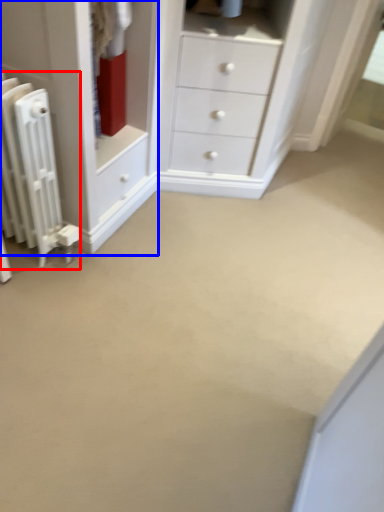
Question: Which of the following is the farthest to the observer, radiator (highlighted by a red box) or chest of drawers (highlighted by a blue box)?

Choices:
 (A) radiator
 (B) chest of drawers

Answer: (B)